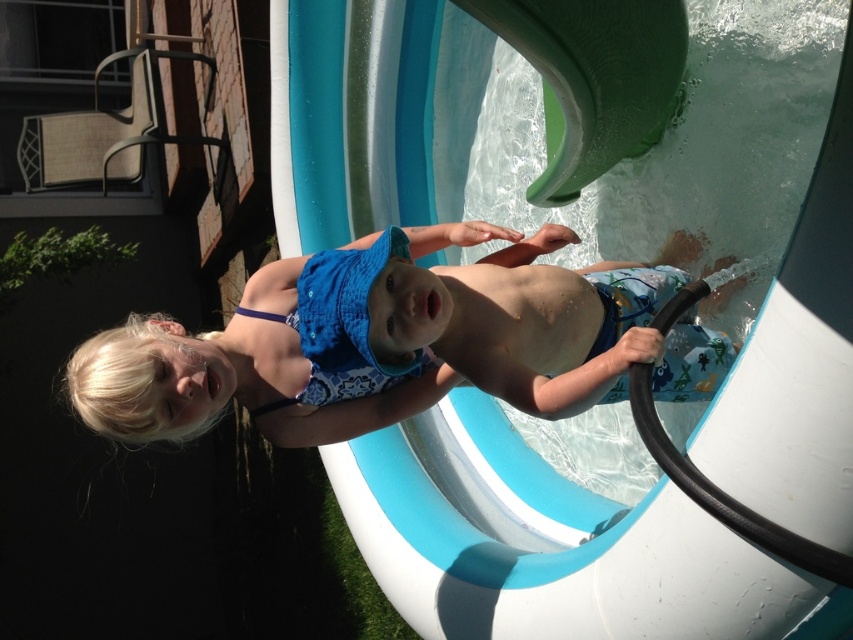
Is point (787, 296) farther from camera compared to point (401, 369)?

That is False.

Is green rubber slide at upper center below blue printed fabric bikini top at center?

Yes.

Between point (386, 173) and point (375, 358), which one is positioned in front?

Point (375, 358) is more forward.

Identify the location of green rubber slide at upper center. The image size is (853, 640). (550, 545).

Which is behind, point (364, 26) or point (659, 339)?

The point (364, 26) is more distant.

Who is taller, green rubber slide at upper center or blue fabric swimsuit at center?

green rubber slide at upper center

Which is behind, point (612, 609) or point (573, 362)?

The point (573, 362) is more distant.

Locate an element on the screen. green rubber slide at upper center is located at coordinates (550, 545).

Does blue fabric swimsuit at center have a greater width compared to blue printed fabric bikini top at center?

Yes, blue fabric swimsuit at center is wider than blue printed fabric bikini top at center.

Can you confirm if blue fabric swimsuit at center is positioned below blue printed fabric bikini top at center?

Indeed, blue fabric swimsuit at center is positioned under blue printed fabric bikini top at center.

Describe the element at coordinates (398, 340) in the screenshot. The height and width of the screenshot is (640, 853). I see `blue fabric swimsuit at center` at that location.

The height and width of the screenshot is (640, 853). I want to click on blue fabric swimsuit at center, so click(x=398, y=340).